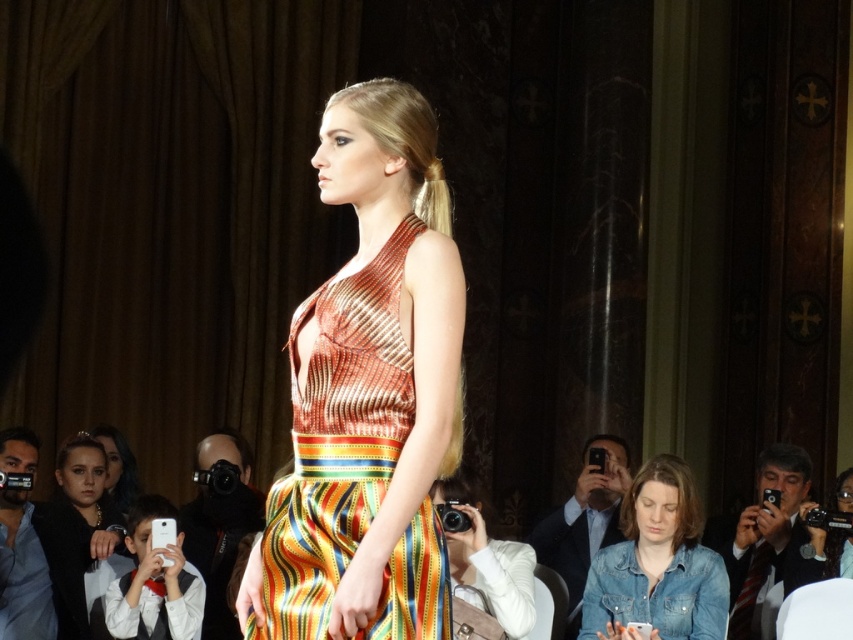
Question: Which object appears farthest from the camera in this image?

Choices:
 (A) matte black hair at lower left
 (B) matte black jacket at lower left
 (C) denim jacket at lower right

Answer: (A)

Question: Does metallic ribbed dress at center appear under denim jacket at lower right?

Choices:
 (A) yes
 (B) no

Answer: (B)

Question: Is matte black jacket at lower left behind matte black hair at lower left?

Choices:
 (A) yes
 (B) no

Answer: (B)

Question: Is denim jacket at lower right above matte black jacket at lower left?

Choices:
 (A) no
 (B) yes

Answer: (B)

Question: Which object is positioned closest to the metallic ribbed dress at center?

Choices:
 (A) matte black jacket at lower left
 (B) denim jacket at lower right
 (C) matte black hair at lower left

Answer: (B)

Question: Which object is farther from the camera taking this photo?

Choices:
 (A) metallic ribbed dress at center
 (B) denim jacket at lower right

Answer: (B)